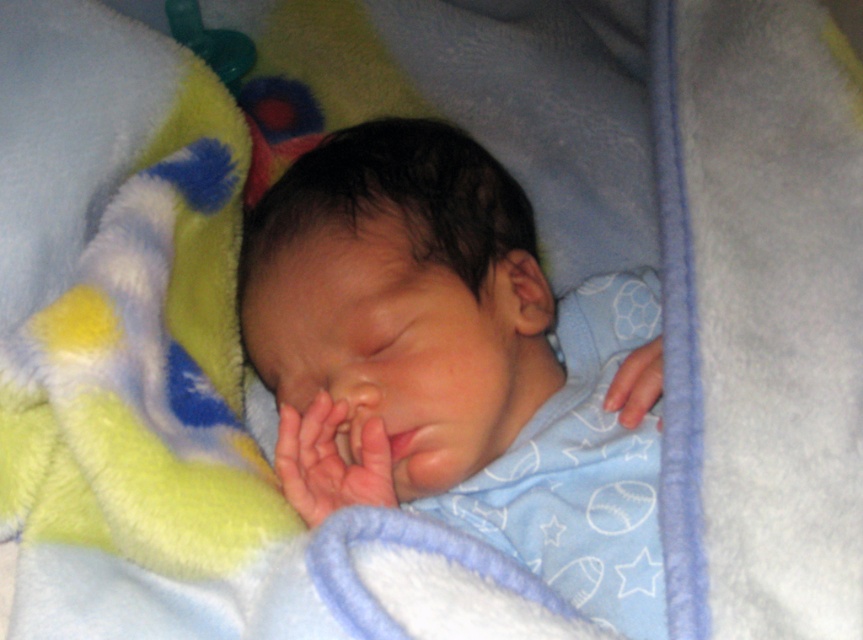
In the image of the sleeping baby, there is a point labeled at coordinates (x=331, y=460). Based on the scene description, what does this point most likely represent?

The point at (x=331, y=460) marks the smooth skin hand at center, indicating the baby is lying on its back with hands near the center of the body.